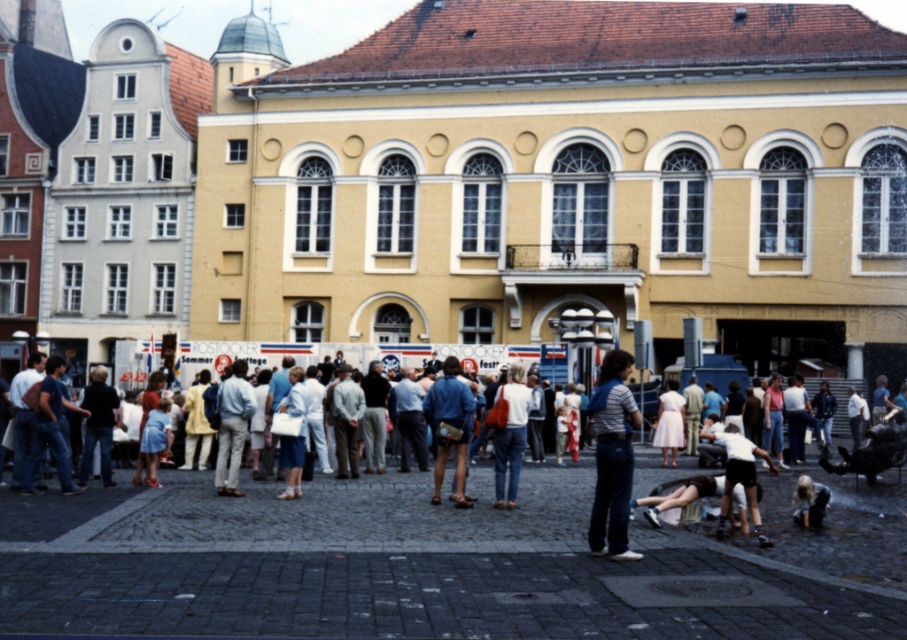
You are standing in the town square and want to take a photo of the historical building. There are two points marked in the scene. The first point is at coordinates point (499, 504) and the second at point (818, 516). Which point should you stand at to ensure the historical building is fully visible without any obstruction?

You should stand at point (818, 516) because point (499, 504) is behind it, meaning standing there might block the view of the historical building.